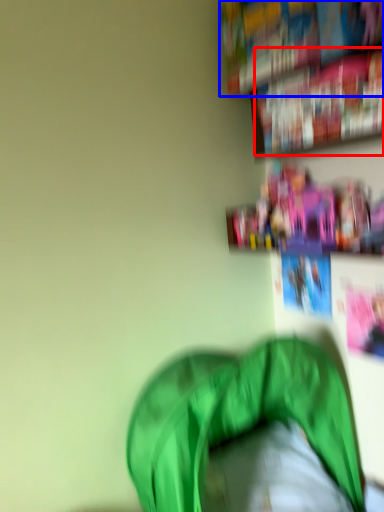
Question: Which of the following is the farthest to the observer, book (highlighted by a red box) or book (highlighted by a blue box)?

Choices:
 (A) book
 (B) book

Answer: (B)